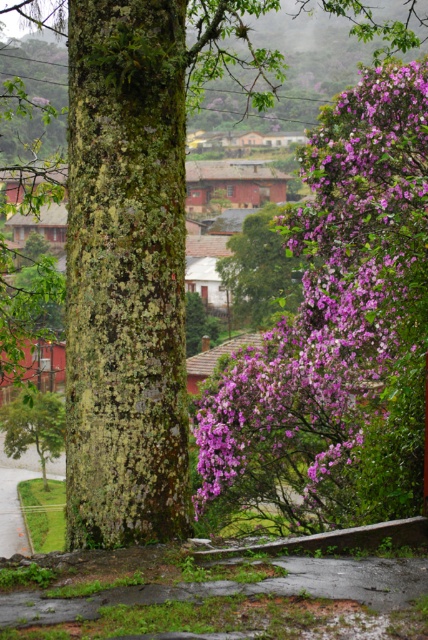
Is green mossy bark at center below green mossy tree at lower left?

No, green mossy bark at center is not below green mossy tree at lower left.

Who is shorter, green mossy bark at center or green mossy tree at lower left?

green mossy bark at center is shorter.

Where is `green mossy bark at center`? The height and width of the screenshot is (640, 428). green mossy bark at center is located at coordinates click(x=125, y=273).

This screenshot has width=428, height=640. I want to click on green mossy bark at center, so click(x=125, y=273).

Is purple matte flower at right taller than purple leafy tree at center?

Incorrect, purple matte flower at right's height is not larger of purple leafy tree at center's.

Between purple matte flower at right and purple leafy tree at center, which one has more height?

purple leafy tree at center

The width and height of the screenshot is (428, 640). I want to click on purple matte flower at right, so click(336, 332).

Where is `purple matte flower at right`? purple matte flower at right is located at coordinates (336, 332).

Is point (303, 250) positioned after point (6, 404)?

No, (303, 250) is in front of (6, 404).

What are the coordinates of `purple matte flower at right` in the screenshot? It's located at (336, 332).

Locate an element on the screen. purple matte flower at right is located at coordinates (336, 332).